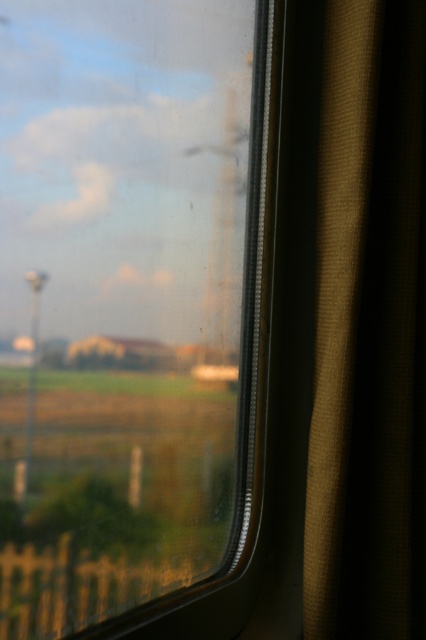
Question: Which point is closer to the camera?

Choices:
 (A) brown textured curtain at right
 (B) transparent glass train window at center

Answer: (B)

Question: Is transparent glass train window at center to the left of brown textured curtain at right from the viewer's perspective?

Choices:
 (A) no
 (B) yes

Answer: (B)

Question: Where is transparent glass train window at center located in relation to brown textured curtain at right in the image?

Choices:
 (A) left
 (B) right

Answer: (A)

Question: Which point is farther to the camera?

Choices:
 (A) (394, 32)
 (B) (49, 4)

Answer: (A)

Question: Can you confirm if transparent glass train window at center is positioned to the right of brown textured curtain at right?

Choices:
 (A) yes
 (B) no

Answer: (B)

Question: Which point appears closest to the camera in this image?

Choices:
 (A) (135, 488)
 (B) (351, 6)

Answer: (A)